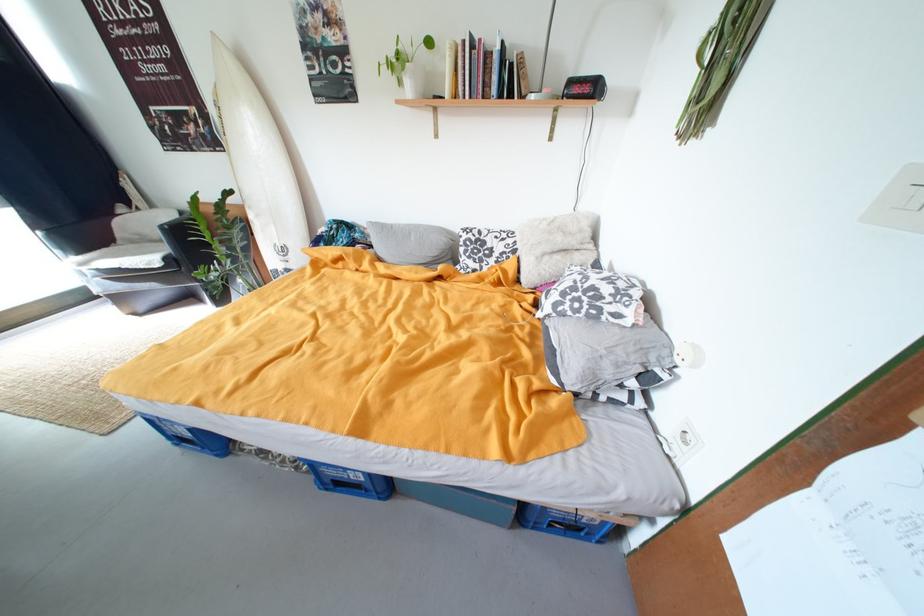
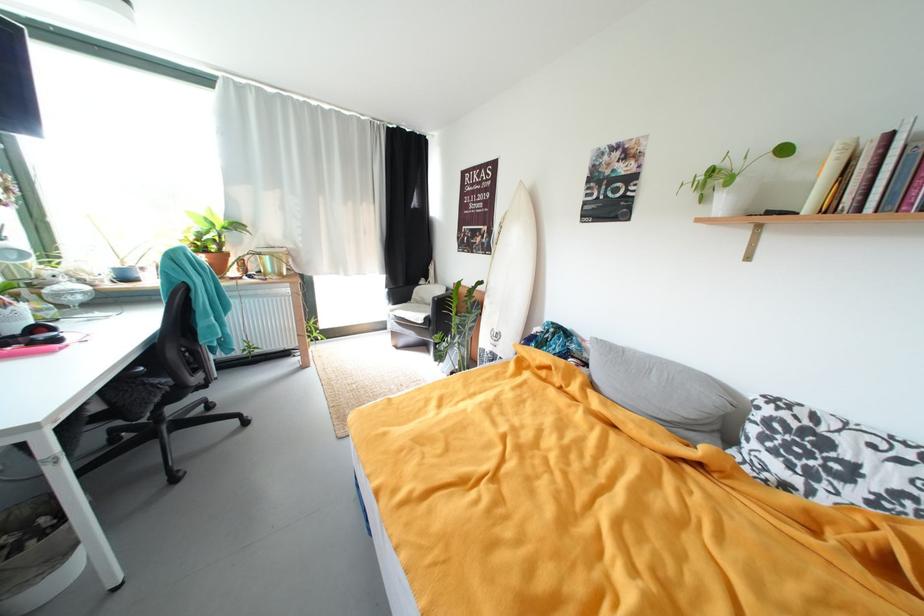
In the second image, find the point that corresponds to point 464,99 in the first image.

(837, 212)